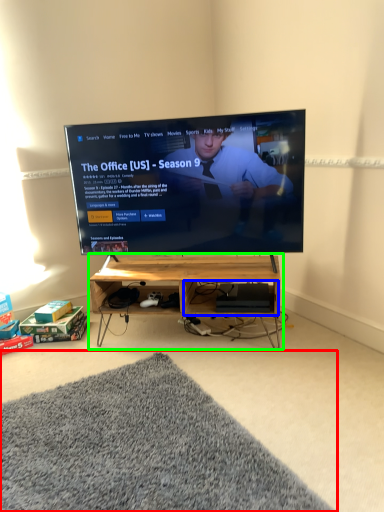
Question: Which object is the farthest from mat (highlighted by a red box)? Choose among these: shelf (highlighted by a blue box) or shelf (highlighted by a green box).

Choices:
 (A) shelf
 (B) shelf

Answer: (A)